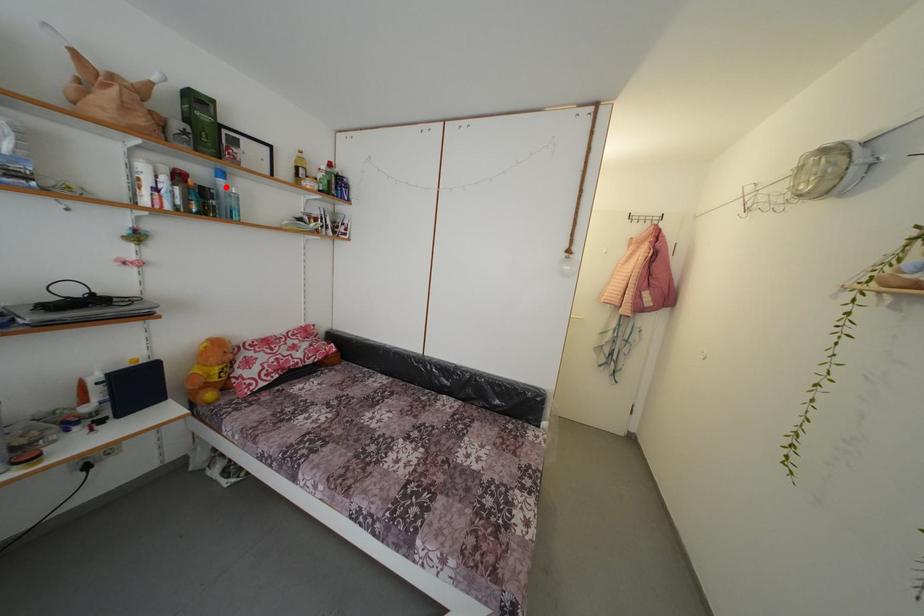
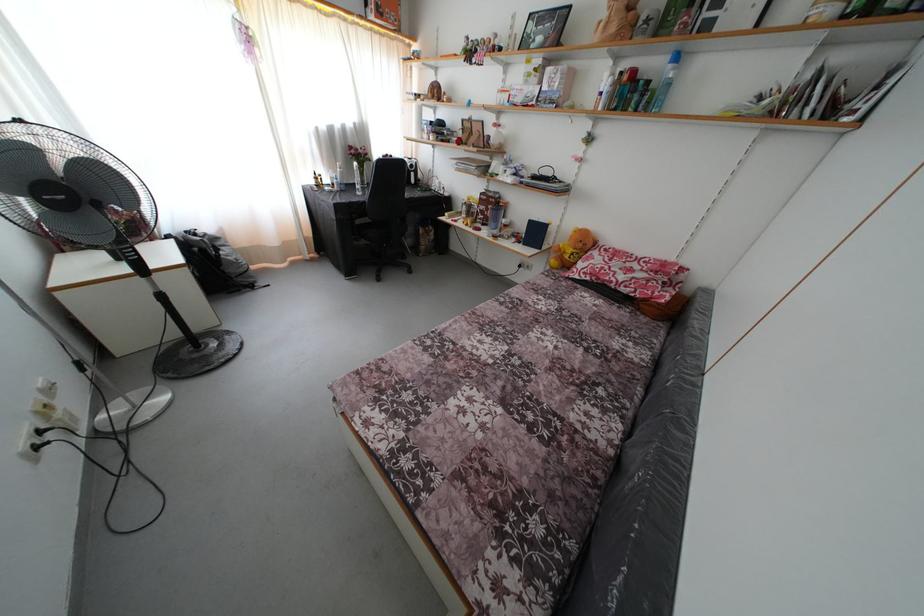
Question: I am providing you with two images of the same scene from different viewpoints. A red point is marked on the first image. Can you still see the location of the red point in image 2?

Choices:
 (A) Yes
 (B) No

Answer: (A)